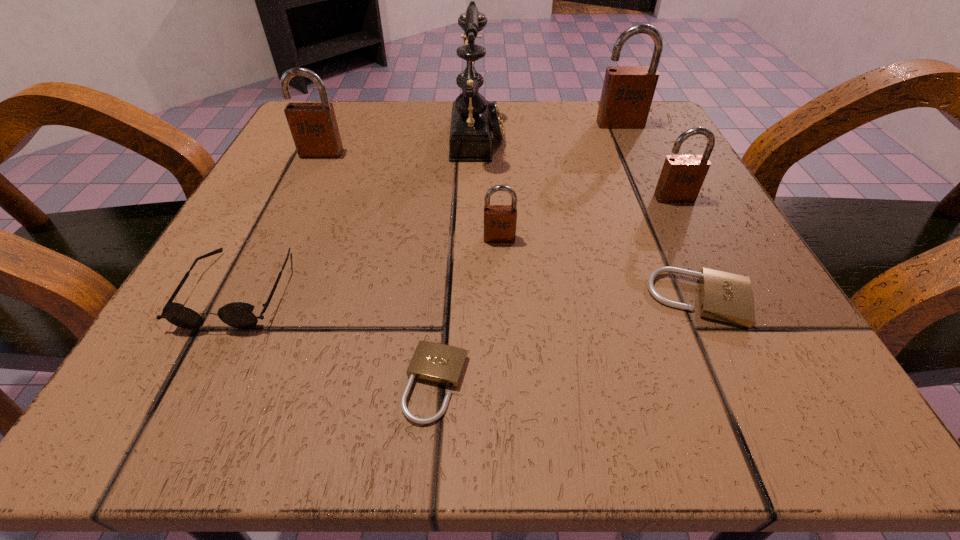
You are a GUI agent. You are given a task and a screenshot of the screen. Output one action in this format:
    pyautogui.click(x=<x>, y=<y>)
    Task: Click on the brown padlock object that ranks as the third closest to the third brown padlock from right to left
    This screenshot has width=960, height=540.
    Given the screenshot: What is the action you would take?
    pyautogui.click(x=627, y=93)

Find the location of a particular element. This screenshot has height=540, width=960. vacant space that satisfies the following two spatial constraints: 1. on the front-facing side of the second shortest padlock; 2. on the right side of the leftmost padlock is located at coordinates (252, 299).

The image size is (960, 540). In order to click on vacant space that satisfies the following two spatial constraints: 1. on the front-facing side of the sunglasses; 2. on the right side of the fifth tallest padlock in this screenshot , I will do `click(233, 299)`.